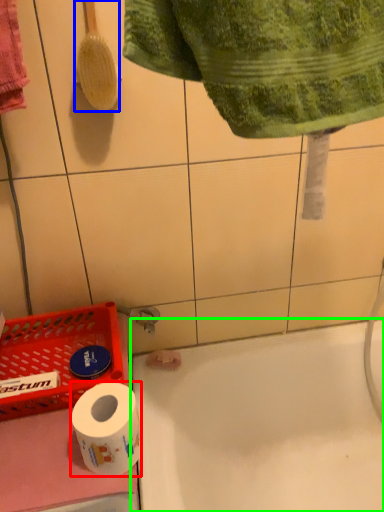
Question: Which object is positioned closest to toilet paper (highlighted by a red box)? Select from brush (highlighted by a blue box) and bath (highlighted by a green box).

Choices:
 (A) brush
 (B) bath

Answer: (B)